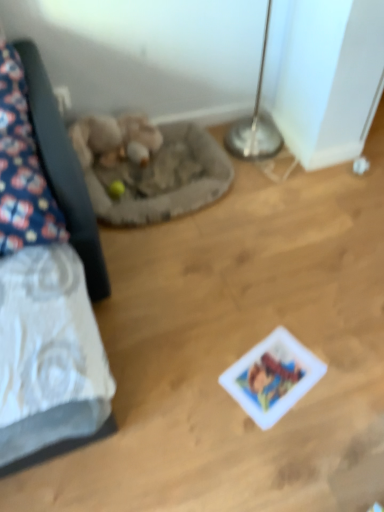
Image resolution: width=384 pixels, height=512 pixels. I want to click on gray fabric cat bed at center-left, so click(152, 170).

Find the location of `fluffy fabric pillow at left`. fluffy fabric pillow at left is located at coordinates (22, 168).

Locate an element on the screen. The width and height of the screenshot is (384, 512). gray fabric cat bed at center-left is located at coordinates (152, 170).

Is the position of gray fabric cat bed at center-left more distant than that of white glossy card at center?

Yes, gray fabric cat bed at center-left is further from the viewer.

From the image's perspective, is gray fabric cat bed at center-left under white glossy card at center?

No.

Considering the positions of objects gray fabric cat bed at center-left and white glossy card at center in the image provided, who is more to the left, gray fabric cat bed at center-left or white glossy card at center?

Positioned to the left is gray fabric cat bed at center-left.

Looking at this image, from the image's perspective, who appears lower, white glossy card at center or gray fabric cat bed at center-left?

From the image's view, white glossy card at center is below.

The height and width of the screenshot is (512, 384). I want to click on card game in front of the gray fabric cat bed at center-left, so coord(272,377).

Based on the photo, considering the sizes of white glossy card at center and gray fabric cat bed at center-left in the image, is white glossy card at center wider or thinner than gray fabric cat bed at center-left?

Considering their sizes, white glossy card at center looks slimmer than gray fabric cat bed at center-left.

Which object is closer to the camera taking this photo, white glossy card at center or fluffy fabric pillow at left?

Positioned in front is fluffy fabric pillow at left.

Can you confirm if white glossy card at center is thinner than fluffy fabric pillow at left?

Yes.

From the image's perspective, is white glossy card at center over fluffy fabric pillow at left?

Actually, white glossy card at center appears below fluffy fabric pillow at left in the image.

Is white glossy card at center oriented away from fluffy fabric pillow at left?

No, white glossy card at center is not facing away from fluffy fabric pillow at left.

What's the angular difference between gray fabric cat bed at center-left and fluffy fabric pillow at left's facing directions?

1.57 degrees.

Locate an element on the screen. The height and width of the screenshot is (512, 384). cat bed behind the fluffy fabric pillow at left is located at coordinates (152, 170).

Consider the image. Is gray fabric cat bed at center-left further to the viewer compared to fluffy fabric pillow at left?

A: Yes, it is behind fluffy fabric pillow at left.

Is gray fabric cat bed at center-left aimed at fluffy fabric pillow at left?

No, gray fabric cat bed at center-left is not facing towards fluffy fabric pillow at left.

From a real-world perspective, is white glossy card at center located higher than fuzzy beige stuffed animal at center-left?

Actually, white glossy card at center is physically below fuzzy beige stuffed animal at center-left in the real world.

How many degrees apart are the facing directions of white glossy card at center and fuzzy beige stuffed animal at center-left?

There is a 70.3-degree angle between the facing directions of white glossy card at center and fuzzy beige stuffed animal at center-left.

Who is shorter, white glossy card at center or fuzzy beige stuffed animal at center-left?

Standing shorter between the two is white glossy card at center.

From the image's perspective, is white glossy card at center under fuzzy beige stuffed animal at center-left?

Yes, from the image's perspective, white glossy card at center is below fuzzy beige stuffed animal at center-left.

There is a gray fabric cat bed at center-left. Where is `animal above it (from a real-world perspective)`? animal above it (from a real-world perspective) is located at coordinates (112, 135).

Is gray fabric cat bed at center-left a part of fuzzy beige stuffed animal at center-left?

No, gray fabric cat bed at center-left is not surrounded by fuzzy beige stuffed animal at center-left.

Does fuzzy beige stuffed animal at center-left appear on the right side of gray fabric cat bed at center-left?

No.

From the image's perspective, which one is positioned higher, fuzzy beige stuffed animal at center-left or gray fabric cat bed at center-left?

fuzzy beige stuffed animal at center-left.

How many degrees apart are the facing directions of fuzzy beige stuffed animal at center-left and fluffy fabric pillow at left?

They differ by 1.57 degrees in their facing directions.

Does fuzzy beige stuffed animal at center-left have a greater height compared to fluffy fabric pillow at left?

No.

In the scene shown: From a real-world perspective, is fuzzy beige stuffed animal at center-left under fluffy fabric pillow at left?

Correct, in the physical world, fuzzy beige stuffed animal at center-left is lower than fluffy fabric pillow at left.

In the scene shown: From the image's perspective, is fuzzy beige stuffed animal at center-left over fluffy fabric pillow at left?

Yes.

You are a GUI agent. You are given a task and a screenshot of the screen. Output one action in this format:
    pyautogui.click(x=<x>, y=<y>)
    Task: Click on the card game that appears on the right of gray fabric cat bed at center-left
    
    Given the screenshot: What is the action you would take?
    pyautogui.click(x=272, y=377)

Find the location of `card game beneath the gray fabric cat bed at center-left (from a real-world perspective)`. card game beneath the gray fabric cat bed at center-left (from a real-world perspective) is located at coordinates (272, 377).

Which object lies nearer to the anchor point white glossy card at center, gray fabric cat bed at center-left or fuzzy beige stuffed animal at center-left?

gray fabric cat bed at center-left lies closer to white glossy card at center than the other object.

From the picture: Based on their spatial positions, is gray fabric cat bed at center-left or fluffy fabric pillow at left further from white glossy card at center?

gray fabric cat bed at center-left lies further to white glossy card at center than the other object.

Which object lies further to the anchor point fuzzy beige stuffed animal at center-left, gray fabric cat bed at center-left or fluffy fabric pillow at left?

fluffy fabric pillow at left lies further to fuzzy beige stuffed animal at center-left than the other object.

From the picture: Looking at the image, which one is located further to gray fabric cat bed at center-left, white glossy card at center or fluffy fabric pillow at left?

The object further to gray fabric cat bed at center-left is white glossy card at center.

Looking at the image, which one is located closer to fuzzy beige stuffed animal at center-left, white glossy card at center or gray fabric cat bed at center-left?

gray fabric cat bed at center-left lies closer to fuzzy beige stuffed animal at center-left than the other object.

From the image, which object appears to be nearer to gray fabric cat bed at center-left, fluffy fabric pillow at left or white glossy card at center?

Based on the image, fluffy fabric pillow at left appears to be nearer to gray fabric cat bed at center-left.

When comparing their distances from fuzzy beige stuffed animal at center-left, does gray fabric cat bed at center-left or white glossy card at center seem closer?

gray fabric cat bed at center-left is closer to fuzzy beige stuffed animal at center-left.

Estimate the real-world distances between objects in this image. Which object is further from fuzzy beige stuffed animal at center-left, fluffy fabric pillow at left or gray fabric cat bed at center-left?

Based on the image, fluffy fabric pillow at left appears to be further to fuzzy beige stuffed animal at center-left.

The image size is (384, 512). Find the location of `cat bed between fluffy fabric pillow at left and fuzzy beige stuffed animal at center-left along the z-axis`. cat bed between fluffy fabric pillow at left and fuzzy beige stuffed animal at center-left along the z-axis is located at coordinates [x=152, y=170].

The height and width of the screenshot is (512, 384). Find the location of `cat bed between fuzzy beige stuffed animal at center-left and white glossy card at center from top to bottom`. cat bed between fuzzy beige stuffed animal at center-left and white glossy card at center from top to bottom is located at coordinates (152, 170).

Locate an element on the screen. This screenshot has width=384, height=512. pillow between fuzzy beige stuffed animal at center-left and white glossy card at center from top to bottom is located at coordinates (22, 168).

Find the location of a particular element. The image size is (384, 512). cat bed between fluffy fabric pillow at left and white glossy card at center from top to bottom is located at coordinates click(152, 170).